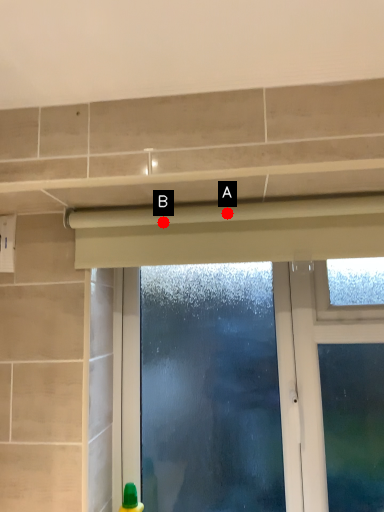
Question: Two points are circled on the image, labeled by A and B beside each circle. Which point is farther from the camera taking this photo?

Choices:
 (A) A is further
 (B) B is further

Answer: (B)